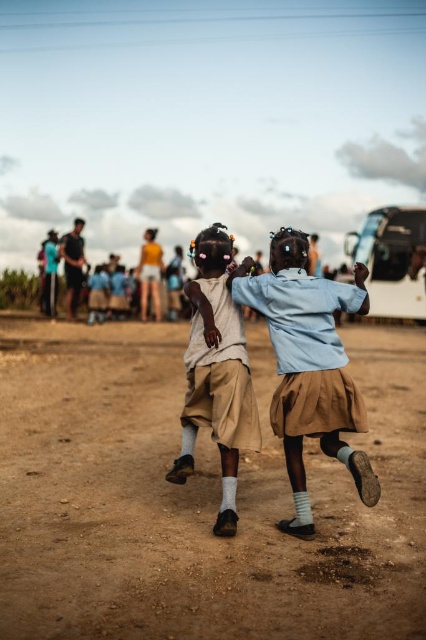
Question: Does brown sandy ground at center appear on the right side of light brown cotton shorts at center?

Choices:
 (A) no
 (B) yes

Answer: (B)

Question: Does brown sandy ground at center have a larger size compared to dark blue shirt at center?

Choices:
 (A) no
 (B) yes

Answer: (B)

Question: Which of the following is the farthest from the observer?

Choices:
 (A) light brown cotton shorts at center
 (B) dark blue shirt at center
 (C) light blue fabric shirt at center
 (D) brown sandy ground at center

Answer: (B)

Question: Does brown sandy ground at center have a lesser width compared to light brown cotton shorts at center?

Choices:
 (A) yes
 (B) no

Answer: (B)

Question: Which point is closer to the camera?

Choices:
 (A) light blue fabric shirt at center
 (B) brown sandy ground at center
 (C) dark blue shirt at center
 (D) light brown cotton shorts at center

Answer: (B)

Question: Among these objects, which one is nearest to the camera?

Choices:
 (A) light blue fabric shirt at center
 (B) brown sandy ground at center
 (C) dark blue shirt at center
 (D) light brown cotton shorts at center

Answer: (B)